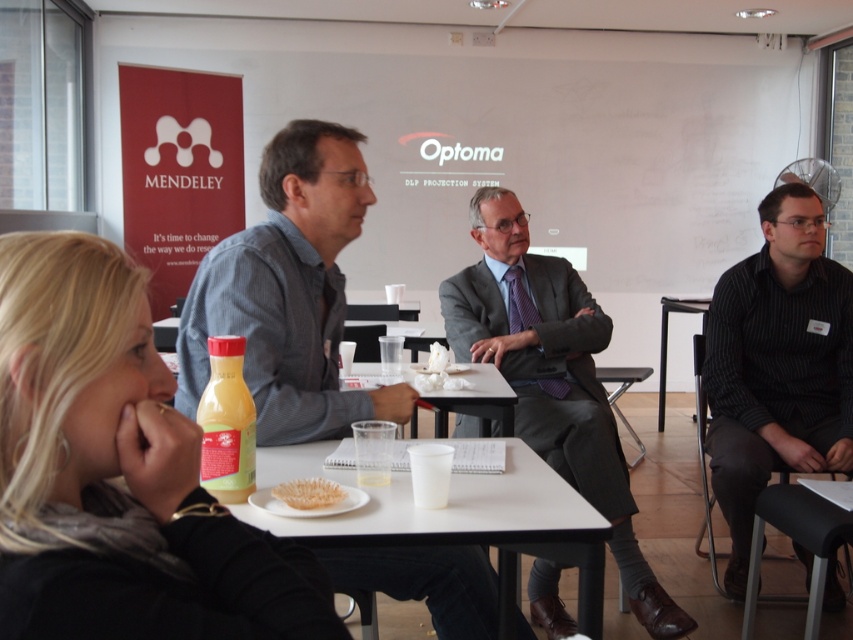
Question: In this image, where is dark gray suit at center located relative to white crumpled paper at center?

Choices:
 (A) right
 (B) left

Answer: (A)

Question: Does black striped shirt at right appear under yellow matte plastic bottle at center?

Choices:
 (A) no
 (B) yes

Answer: (B)

Question: Which point appears closest to the camera in this image?

Choices:
 (A) 769,342
 (B) 570,333
 (C) 440,369

Answer: (C)

Question: Among these objects, which one is nearest to the camera?

Choices:
 (A) white plastic table at lower center
 (B) blue denim shirt at center
 (C) white plastic table at center

Answer: (C)

Question: Which is nearer to the black plastic table at center?

Choices:
 (A) white plastic table at lower center
 (B) dark gray suit at center
 (C) white crumpled paper at center

Answer: (B)

Question: Considering the relative positions of black striped shirt at right and translucent plastic bowl at center in the image provided, where is black striped shirt at right located with respect to translucent plastic bowl at center?

Choices:
 (A) left
 (B) right

Answer: (B)